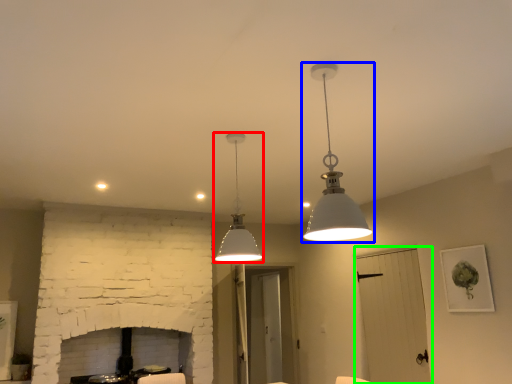
Question: Based on their relative distances, which object is nearer to lamp (highlighted by a red box)? Choose from lamp (highlighted by a blue box) and glass door (highlighted by a green box).

Choices:
 (A) lamp
 (B) glass door

Answer: (A)